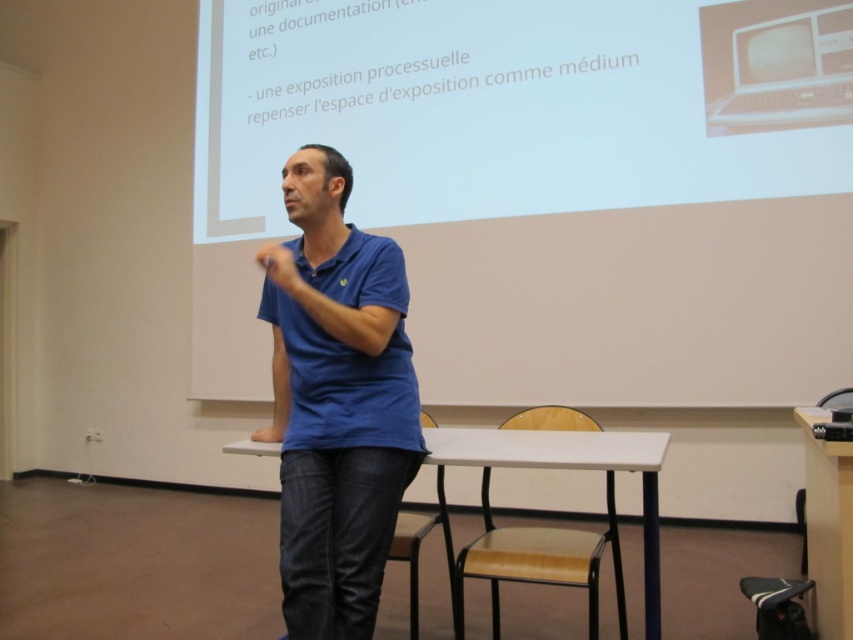
Can you confirm if white glossy projector screen at upper center is positioned to the left of blue cotton shirt at center?

Incorrect, white glossy projector screen at upper center is not on the left side of blue cotton shirt at center.

What do you see at coordinates (521, 104) in the screenshot? I see `white glossy projector screen at upper center` at bounding box center [521, 104].

Does point (447, 4) come farther from viewer compared to point (318, 609)?

Yes, it is behind point (318, 609).

Identify the location of white glossy projector screen at upper center. This screenshot has width=853, height=640. click(x=521, y=104).